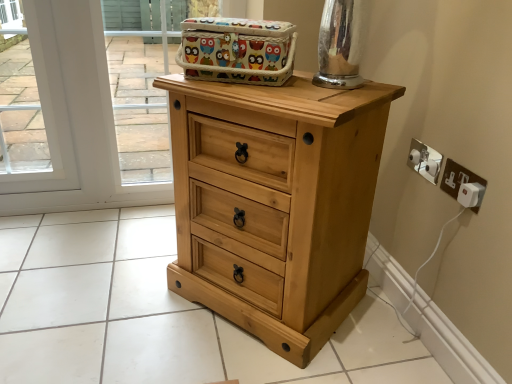
Question: From a real-world perspective, is colorful fabric basket at upper center under wooden basket at upper center?

Choices:
 (A) no
 (B) yes

Answer: (A)

Question: Is colorful fabric basket at upper center taller than wooden basket at upper center?

Choices:
 (A) yes
 (B) no

Answer: (B)

Question: Is colorful fabric basket at upper center at the left side of wooden basket at upper center?

Choices:
 (A) no
 (B) yes

Answer: (A)

Question: Is colorful fabric basket at upper center not near wooden basket at upper center?

Choices:
 (A) no
 (B) yes

Answer: (A)

Question: Considering the relative sizes of colorful fabric basket at upper center and wooden basket at upper center in the image provided, is colorful fabric basket at upper center smaller than wooden basket at upper center?

Choices:
 (A) no
 (B) yes

Answer: (B)

Question: From a real-world perspective, is natural wood chest of drawers at center physically located above or below white plastic plug at lower right, the 1th electric outlet positioned from the front?

Choices:
 (A) below
 (B) above

Answer: (A)

Question: Is natural wood chest of drawers at center wider or thinner than white plastic plug at lower right, marked as the second electric outlet in a back-to-front arrangement?

Choices:
 (A) thin
 (B) wide

Answer: (B)

Question: In terms of size, does natural wood chest of drawers at center appear bigger or smaller than white plastic plug at lower right, marked as the second electric outlet in a back-to-front arrangement?

Choices:
 (A) big
 (B) small

Answer: (A)

Question: Is point (223, 190) positioned closer to the camera than point (471, 203)?

Choices:
 (A) farther
 (B) closer

Answer: (A)

Question: Would you say wooden basket at upper center is inside or outside natural wood chest of drawers at center?

Choices:
 (A) outside
 (B) inside

Answer: (A)

Question: From a real-world perspective, is wooden basket at upper center above or below natural wood chest of drawers at center?

Choices:
 (A) above
 (B) below

Answer: (A)

Question: Visually, is wooden basket at upper center positioned to the left or to the right of natural wood chest of drawers at center?

Choices:
 (A) right
 (B) left

Answer: (B)

Question: Is wooden basket at upper center in front of or behind natural wood chest of drawers at center in the image?

Choices:
 (A) behind
 (B) front

Answer: (A)

Question: Is colorful fabric basket at upper center to the left or to the right of white plastic plug at lower right, the 1th electric outlet positioned from the front, in the image?

Choices:
 (A) right
 (B) left

Answer: (B)

Question: Considering the positions of colorful fabric basket at upper center and white plastic plug at lower right, the 1th electric outlet positioned from the front, in the image, is colorful fabric basket at upper center wider or thinner than white plastic plug at lower right, the 1th electric outlet positioned from the front,?

Choices:
 (A) wide
 (B) thin

Answer: (A)